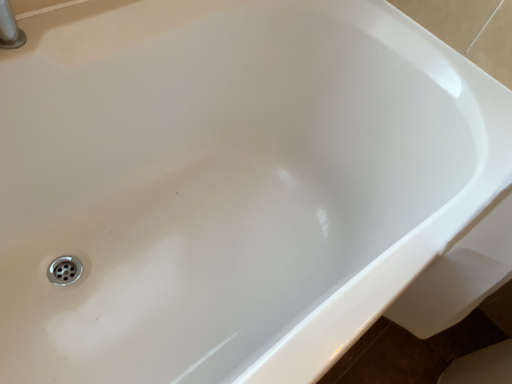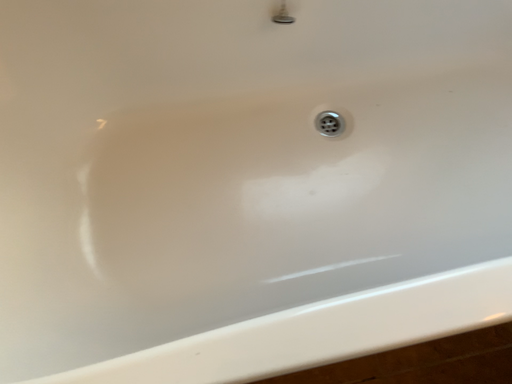
Question: How did the camera likely rotate when shooting the video?

Choices:
 (A) rotated left
 (B) rotated right

Answer: (A)